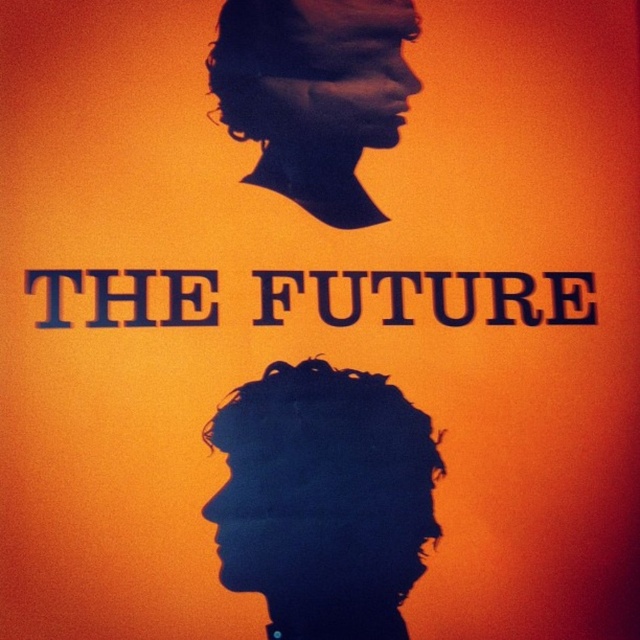
Question: Can you confirm if dark blue textured hair at lower center is smaller than black matte profile at upper center?

Choices:
 (A) yes
 (B) no

Answer: (B)

Question: Which point is closer to the camera taking this photo?

Choices:
 (A) (304, 80)
 (B) (400, 513)

Answer: (B)

Question: Is dark blue textured hair at lower center bigger than black matte profile at upper center?

Choices:
 (A) yes
 (B) no

Answer: (A)

Question: Which object is farther from the camera taking this photo?

Choices:
 (A) dark blue textured hair at lower center
 (B) black matte profile at upper center

Answer: (B)

Question: Where is dark blue textured hair at lower center located in relation to black matte profile at upper center in the image?

Choices:
 (A) right
 (B) left

Answer: (A)